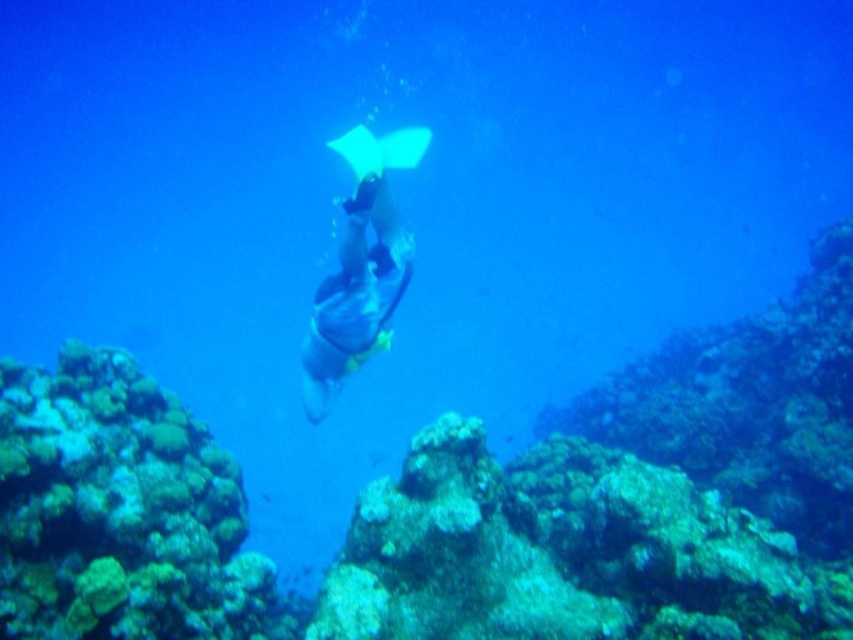
You are a diver in the underwater scene. You need to grab the blue rubber glove at center. Where exactly should you reach to find it?

The blue rubber glove at center is located at point coordinates of (355,296).

You are a marine biologist observing an underwater scene. You notice a rough textured coral reef at center and a translucent white stingray at center. Which object is positioned to the right of the other?

The rough textured coral reef at center is to the right of the translucent white stingray at center.

You are a scuba diver with a 3.5 meter long measuring tape. You want to measure the distance between yourself and the rough textured coral reef at center. Can you accurately measure it with your tape?

The distance between the rough textured coral reef at center and the camera is 3.54 meters. Since your tape is only 3.5 meters long, it is 4 centimeters short. Therefore, you cannot accurately measure the full distance with your tape.